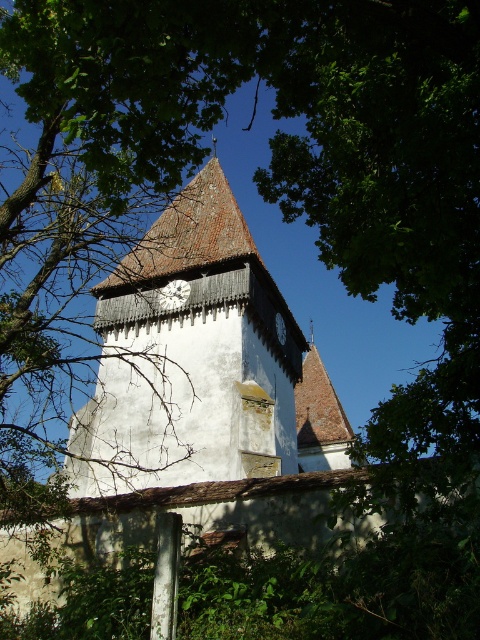
Question: Among these objects, which one is nearest to the camera?

Choices:
 (A) white wooden clock at upper center
 (B) white wooden clock at center

Answer: (B)

Question: Which of the following is the farthest from the observer?

Choices:
 (A) (171, 301)
 (B) (282, 330)

Answer: (B)

Question: Is white wooden clock at center in front of white wooden clock at upper center?

Choices:
 (A) yes
 (B) no

Answer: (A)

Question: Is white wooden clock at center positioned in front of white wooden clock at upper center?

Choices:
 (A) no
 (B) yes

Answer: (B)

Question: Is white wooden clock at center wider than white wooden clock at upper center?

Choices:
 (A) yes
 (B) no

Answer: (A)

Question: Among these points, which one is nearest to the camera?

Choices:
 (A) (180, 292)
 (B) (280, 328)

Answer: (A)